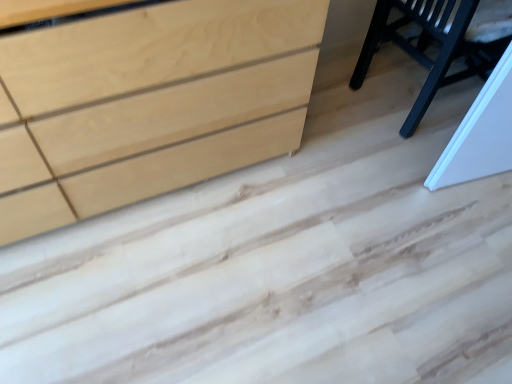
The width and height of the screenshot is (512, 384). Identify the location of natural wood chest of drawers at lower left. (151, 103).

This screenshot has width=512, height=384. What do you see at coordinates (151, 103) in the screenshot? I see `natural wood chest of drawers at lower left` at bounding box center [151, 103].

At what (x,y) coordinates should I click in order to perform the action: click on glossy black chair at upper right. Please return your answer as a coordinate pair (x, y). Looking at the image, I should click on (426, 46).

Describe the element at coordinates (426, 46) in the screenshot. I see `glossy black chair at upper right` at that location.

This screenshot has height=384, width=512. Find the location of `natural wood chest of drawers at lower left`. natural wood chest of drawers at lower left is located at coordinates coord(151,103).

Which object is positioned more to the right, glossy black chair at upper right or natural wood chest of drawers at lower left?

Positioned to the right is glossy black chair at upper right.

Relative to natural wood chest of drawers at lower left, is glossy black chair at upper right in front or behind?

In the image, glossy black chair at upper right appears behind natural wood chest of drawers at lower left.

Is point (436, 16) positioned before point (198, 118)?

That is False.

From the image's perspective, who appears lower, glossy black chair at upper right or natural wood chest of drawers at lower left?

natural wood chest of drawers at lower left appears lower in the image.

From a real-world perspective, between glossy black chair at upper right and natural wood chest of drawers at lower left, who is vertically higher?

natural wood chest of drawers at lower left.

Can you confirm if glossy black chair at upper right is wider than natural wood chest of drawers at lower left?

Yes.

From their relative heights in the image, would you say glossy black chair at upper right is taller or shorter than natural wood chest of drawers at lower left?

Considering their sizes, glossy black chair at upper right has less height than natural wood chest of drawers at lower left.

Looking at the image, does glossy black chair at upper right seem bigger or smaller compared to natural wood chest of drawers at lower left?

glossy black chair at upper right is smaller than natural wood chest of drawers at lower left.

Is glossy black chair at upper right inside the boundaries of natural wood chest of drawers at lower left, or outside?

glossy black chair at upper right exists outside the volume of natural wood chest of drawers at lower left.

Is the surface of glossy black chair at upper right in direct contact with natural wood chest of drawers at lower left?

No.

Is glossy black chair at upper right oriented towards natural wood chest of drawers at lower left?

Yes, glossy black chair at upper right is oriented towards natural wood chest of drawers at lower left.

Locate an element on the screen. The height and width of the screenshot is (384, 512). furniture on the right side of natural wood chest of drawers at lower left is located at coordinates (426, 46).

Considering the positions of objects natural wood chest of drawers at lower left and glossy black chair at upper right in the image provided, who is more to the right, natural wood chest of drawers at lower left or glossy black chair at upper right?

glossy black chair at upper right.

Is natural wood chest of drawers at lower left positioned behind glossy black chair at upper right?

No, natural wood chest of drawers at lower left is closer to the camera.

Does point (212, 83) come farther from viewer compared to point (476, 44)?

No, (212, 83) is in front of (476, 44).

From the image's perspective, is natural wood chest of drawers at lower left beneath glossy black chair at upper right?

Correct, natural wood chest of drawers at lower left appears lower than glossy black chair at upper right in the image.

From a real-world perspective, relative to glossy black chair at upper right, is natural wood chest of drawers at lower left vertically above or below?

Clearly, from a real-world perspective, natural wood chest of drawers at lower left is above glossy black chair at upper right.

Between natural wood chest of drawers at lower left and glossy black chair at upper right, which one has smaller width?

natural wood chest of drawers at lower left.

Consider the image. Considering the sizes of objects natural wood chest of drawers at lower left and glossy black chair at upper right in the image provided, who is taller, natural wood chest of drawers at lower left or glossy black chair at upper right?

Standing taller between the two is natural wood chest of drawers at lower left.

Which of these two, natural wood chest of drawers at lower left or glossy black chair at upper right, is smaller?

glossy black chair at upper right.

In the scene shown: Is natural wood chest of drawers at lower left inside or outside of glossy black chair at upper right?

natural wood chest of drawers at lower left is located beyond the bounds of glossy black chair at upper right.

Would you consider natural wood chest of drawers at lower left to be distant from glossy black chair at upper right?

No, natural wood chest of drawers at lower left is not far from glossy black chair at upper right.

Is natural wood chest of drawers at lower left turned away from glossy black chair at upper right?

No, glossy black chair at upper right is not at the back of natural wood chest of drawers at lower left.

From the picture: How many degrees apart are the facing directions of natural wood chest of drawers at lower left and glossy black chair at upper right?

They differ by 90.3 degrees in their facing directions.

How much distance is there between natural wood chest of drawers at lower left and glossy black chair at upper right?

A distance of 34.41 inches exists between natural wood chest of drawers at lower left and glossy black chair at upper right.

Find the location of `the chest of drawers lying below the glossy black chair at upper right (from the image's perspective)`. the chest of drawers lying below the glossy black chair at upper right (from the image's perspective) is located at coordinates (x=151, y=103).

This screenshot has height=384, width=512. I want to click on the chest of drawers lying in front of the glossy black chair at upper right, so click(151, 103).

What are the coordinates of `furniture above the natural wood chest of drawers at lower left (from the image's perspective)` in the screenshot? It's located at pos(426,46).